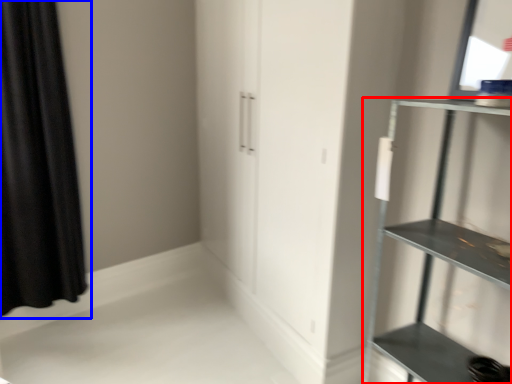
Question: Which of the following is the closest to the observer, shelf (highlighted by a red box) or curtain (highlighted by a blue box)?

Choices:
 (A) shelf
 (B) curtain

Answer: (A)